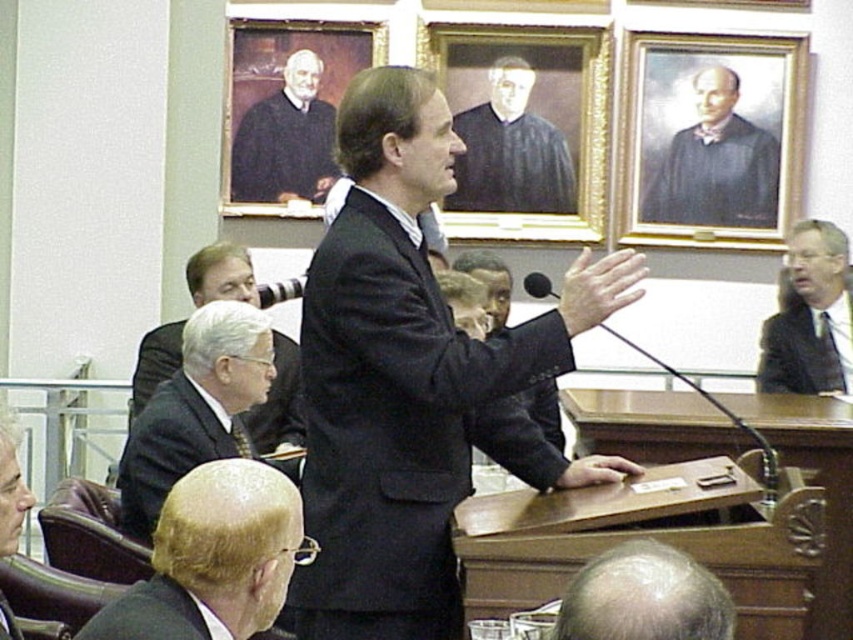
You are an observer in the courtroom. You notice the bald head at lower left and the matte black robe at upper left. Which object appears larger in the image?

The bald head at lower left appears larger than the matte black robe at upper left in the image.